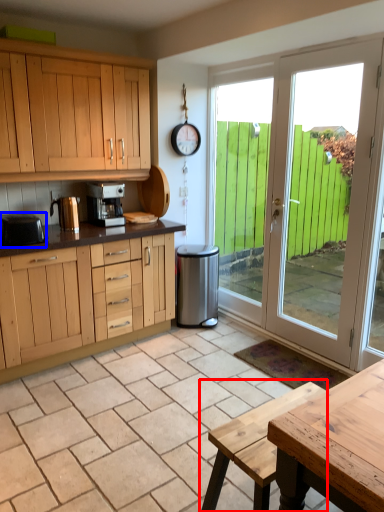
Question: Which object is closer to the camera taking this photo, picnic table (highlighted by a red box) or appliance (highlighted by a blue box)?

Choices:
 (A) picnic table
 (B) appliance

Answer: (A)